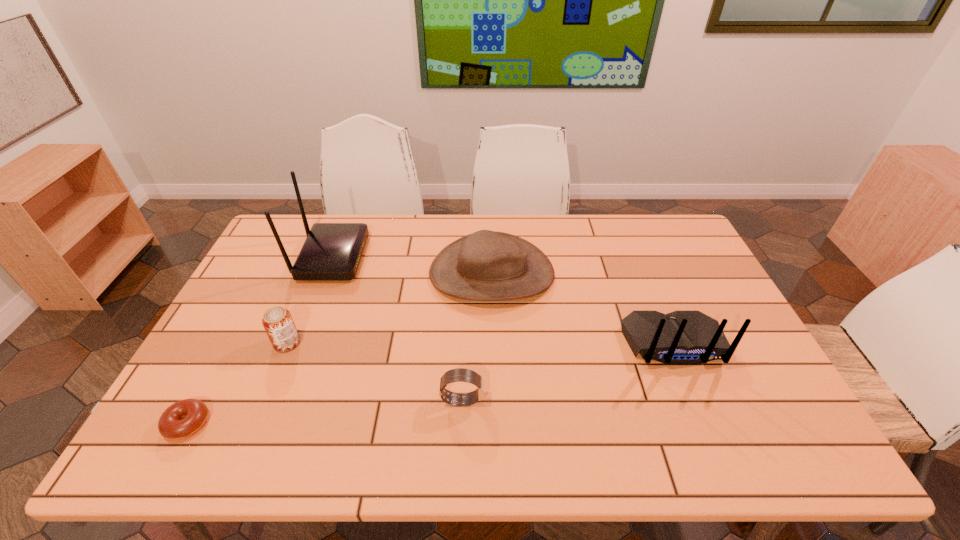
Identify the location of object at the right edge. This screenshot has width=960, height=540. (681, 337).

The image size is (960, 540). I want to click on object at the far left corner, so click(332, 251).

Find the location of a particular element. The height and width of the screenshot is (540, 960). object that is at the near left corner is located at coordinates (182, 419).

Locate an element on the screen. free space at the far edge is located at coordinates (374, 235).

You are a GUI agent. You are given a task and a screenshot of the screen. Output one action in this format:
    pyautogui.click(x=<x>, y=<y>)
    Task: Click on the blank area at the left edge
    
    Given the screenshot: What is the action you would take?
    pyautogui.click(x=287, y=280)

Where is `vacant region at the right edge of the desktop`? The width and height of the screenshot is (960, 540). vacant region at the right edge of the desktop is located at coordinates (x=767, y=421).

This screenshot has height=540, width=960. I want to click on free point between the beer can and the doughnut, so click(237, 383).

You are a GUI agent. You are given a task and a screenshot of the screen. Output one action in this format:
    pyautogui.click(x=<x>, y=<y>)
    Task: Click on the vacant space in between the farther router and the beer can
    The height and width of the screenshot is (540, 960).
    Given the screenshot: What is the action you would take?
    pyautogui.click(x=309, y=300)

Find the location of a particular element. The image size is (960, 540). free spot between the cowboy hat and the left router is located at coordinates (412, 265).

Find the location of `free point between the beer can and the tallest object`. free point between the beer can and the tallest object is located at coordinates (309, 300).